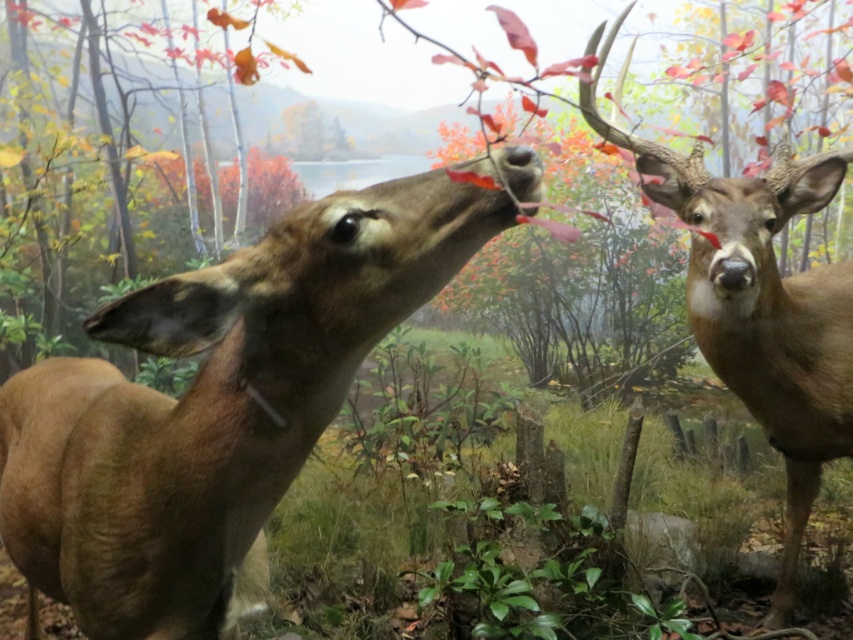
Between point (219, 406) and point (738, 227), which one is positioned behind?

The point (738, 227) is behind.

Locate an element on the screen. brown matte/deer at left is located at coordinates (221, 403).

At what (x,y) coordinates should I click in order to perform the action: click on brown matte/deer at left. Please return your answer as a coordinate pair (x, y). Image resolution: width=853 pixels, height=640 pixels. Looking at the image, I should click on (221, 403).

The image size is (853, 640). I want to click on brown matte/deer at left, so click(221, 403).